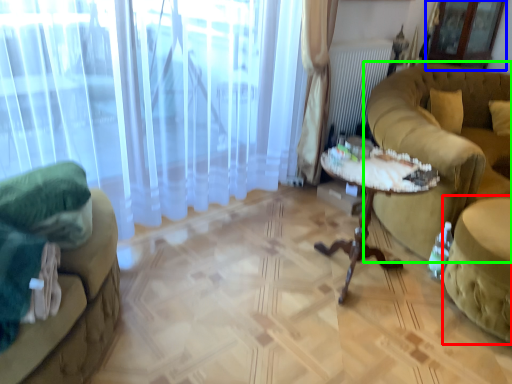
Question: Considering the real-world distances, which object is closest to swivel chair (highlighted by a red box)? screen door (highlighted by a blue box) or studio couch (highlighted by a green box).

Choices:
 (A) screen door
 (B) studio couch

Answer: (B)